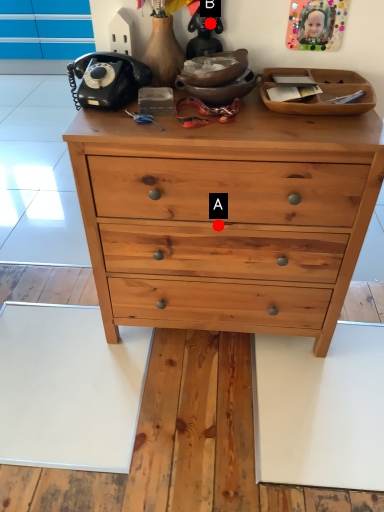
Question: Two points are circled on the image, labeled by A and B beside each circle. Which point appears farthest from the camera in this image?

Choices:
 (A) A is further
 (B) B is further

Answer: (B)